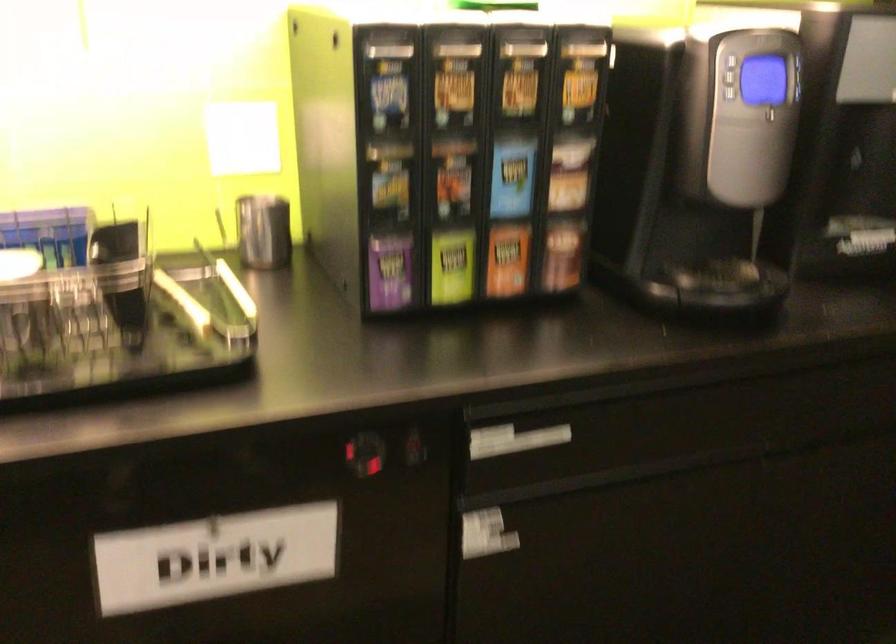
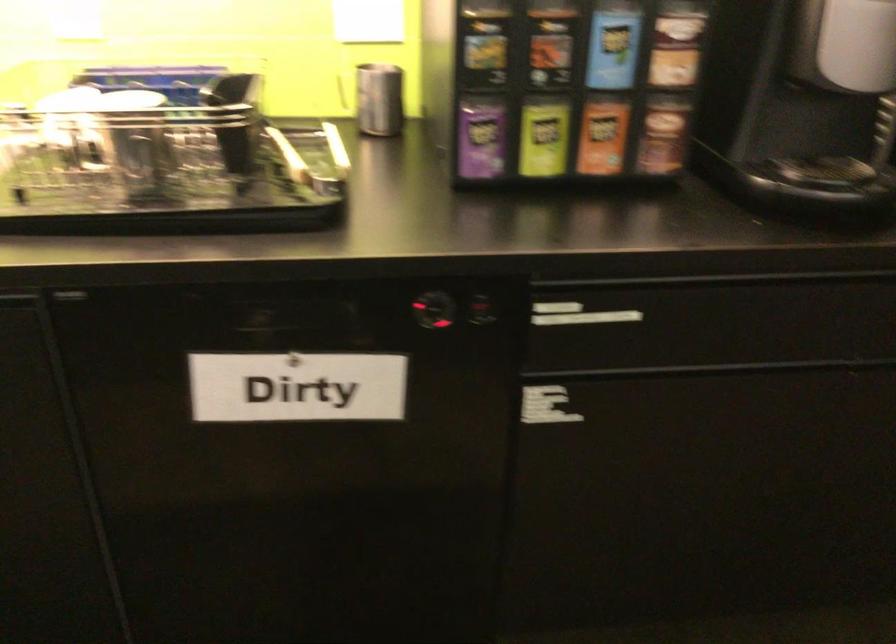
Question: The first image is from the beginning of the video and the second image is from the end. How did the camera likely rotate when shooting the video?

Choices:
 (A) Left
 (B) Right
 (C) Up
 (D) Down

Answer: (A)